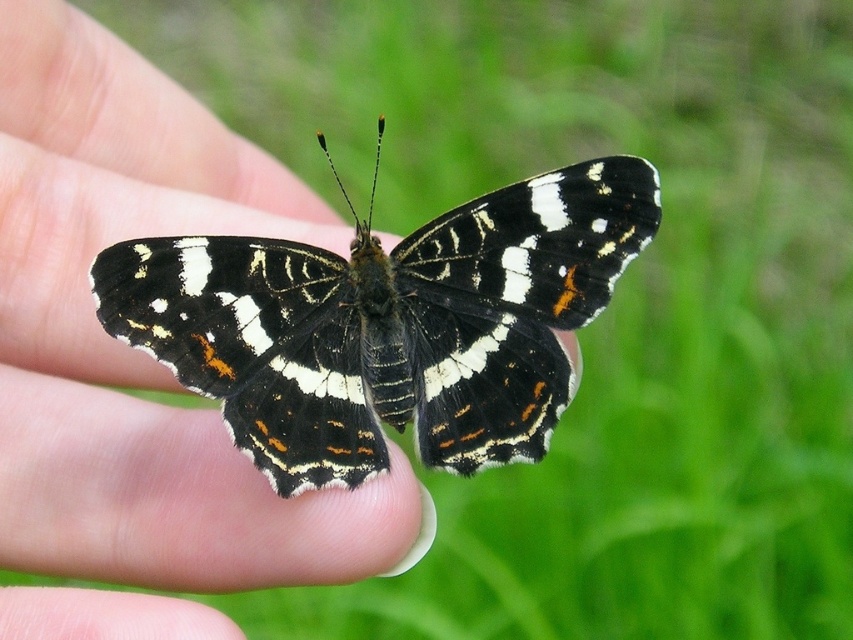
Does smooth skin at center have a greater height compared to black glossy butterfly at center?

Yes, smooth skin at center is taller than black glossy butterfly at center.

Measure the distance between smooth skin at center and camera.

1.05 meters

In order to click on smooth skin at center in this screenshot , I will do `click(132, 349)`.